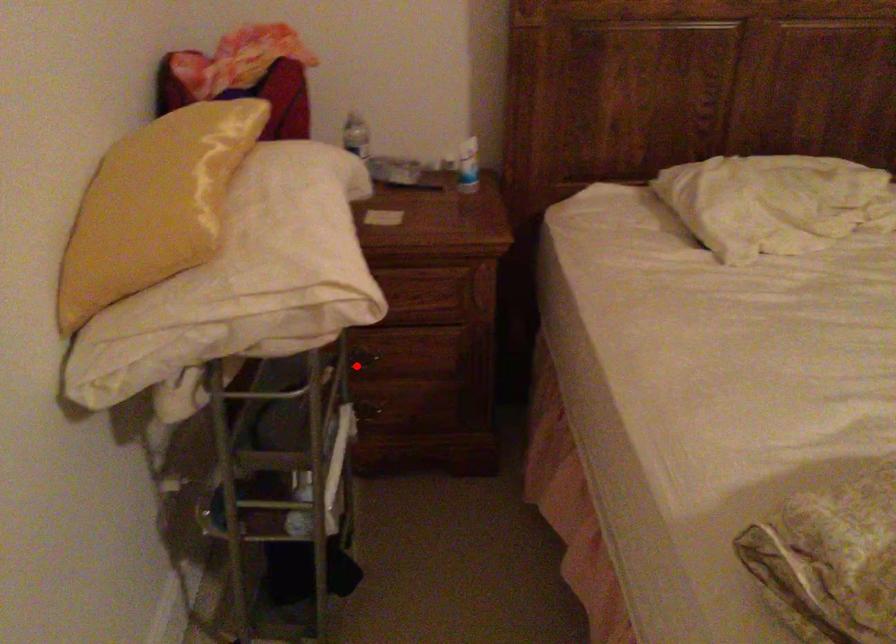
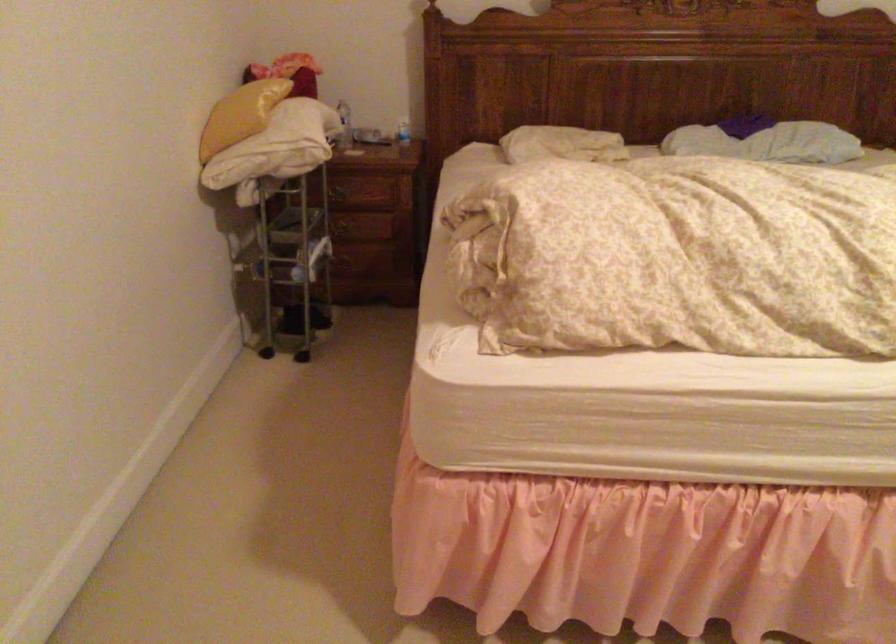
In the second image, find the point that corresponds to the highlighted location in the first image.

(342, 230)